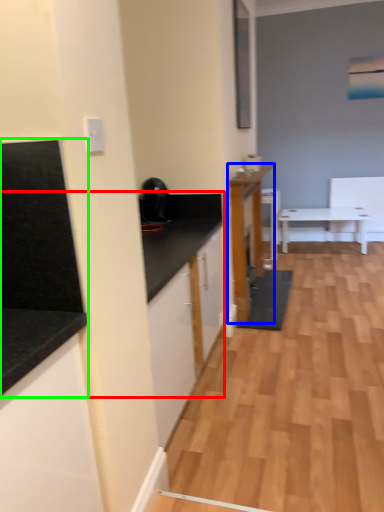
Question: Which object is the farthest from countertop (highlighted by a red box)? Choose among these: cabinetry (highlighted by a blue box) or countertop (highlighted by a green box).

Choices:
 (A) cabinetry
 (B) countertop

Answer: (A)